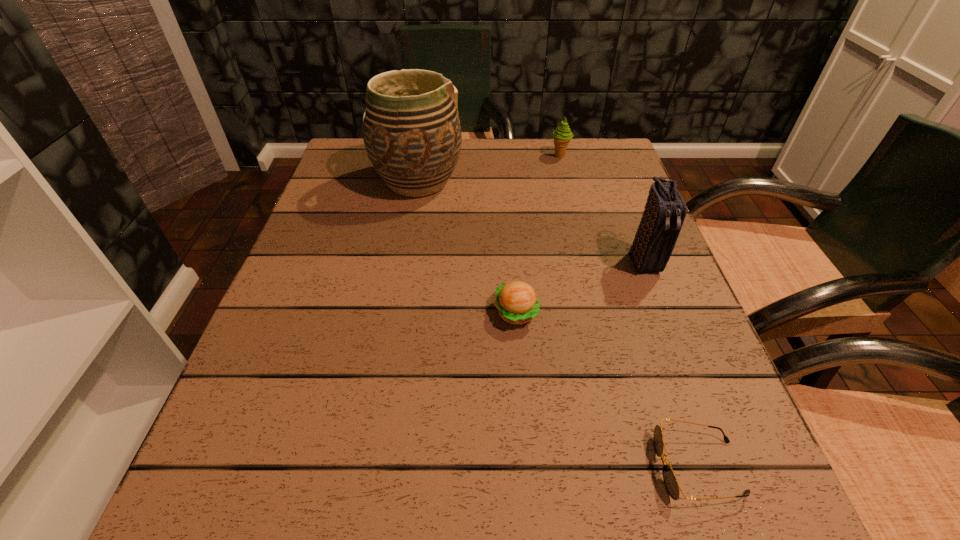
Find the location of `object that is the closest to the sunglasses`. object that is the closest to the sunglasses is located at coordinates (516, 301).

Locate which object ranks in proximity to the nearest object. Please provide its 2D coordinates. Your answer should be formatted as a tuple, i.e. [(x, y)], where the tuple contains the x and y coordinates of a point satisfying the conditions above.

[(516, 301)]

This screenshot has width=960, height=540. In order to click on free space that satisfies the following two spatial constraints: 1. with the zip open on the second tallest object; 2. on the front-facing side of the shortest object in this screenshot , I will do `click(724, 467)`.

This screenshot has width=960, height=540. Identify the location of blank area in the image that satisfies the following two spatial constraints: 1. on the front side of the tallest object; 2. on the right side of the fourth tallest object. (395, 313).